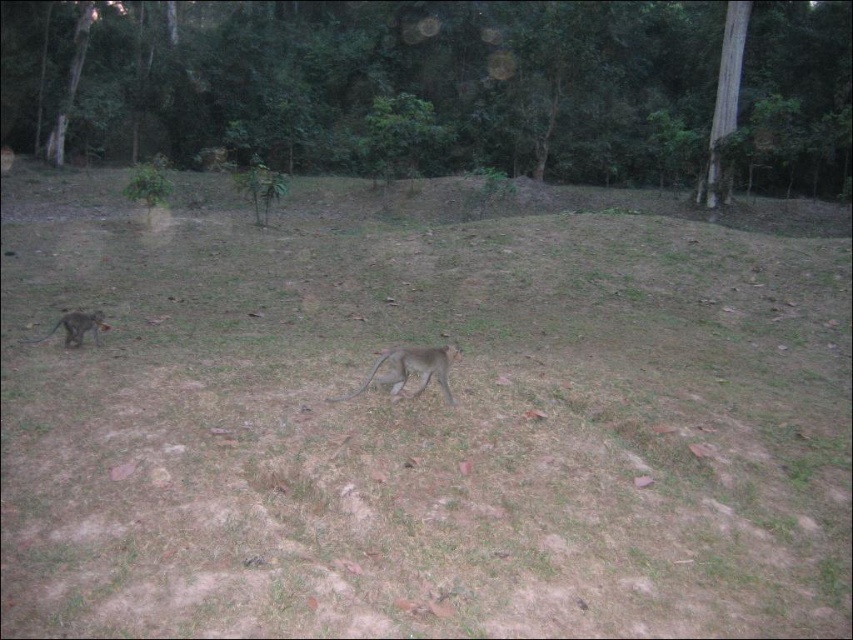
Question: Considering the relative positions of gray furry monkey at center and gray fur monkey at lower left in the image provided, where is gray furry monkey at center located with respect to gray fur monkey at lower left?

Choices:
 (A) left
 (B) right

Answer: (B)

Question: Is gray furry monkey at center to the right of gray fur monkey at lower left from the viewer's perspective?

Choices:
 (A) yes
 (B) no

Answer: (A)

Question: Which object is farther from the camera taking this photo?

Choices:
 (A) gray furry monkey at center
 (B) gray fur monkey at lower left

Answer: (B)

Question: Is gray furry monkey at center wider than gray fur monkey at lower left?

Choices:
 (A) no
 (B) yes

Answer: (B)